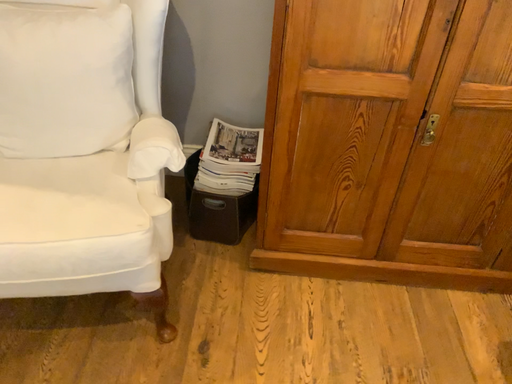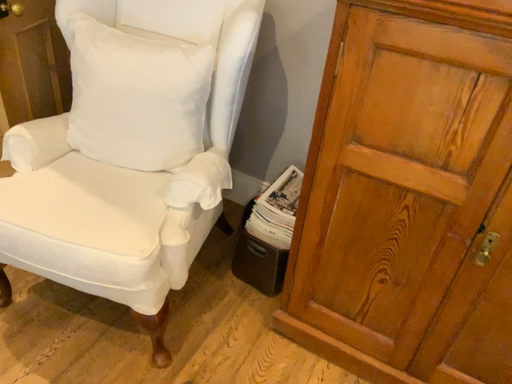
Question: Which way did the camera rotate in the video?

Choices:
 (A) rotated left
 (B) rotated right

Answer: (A)